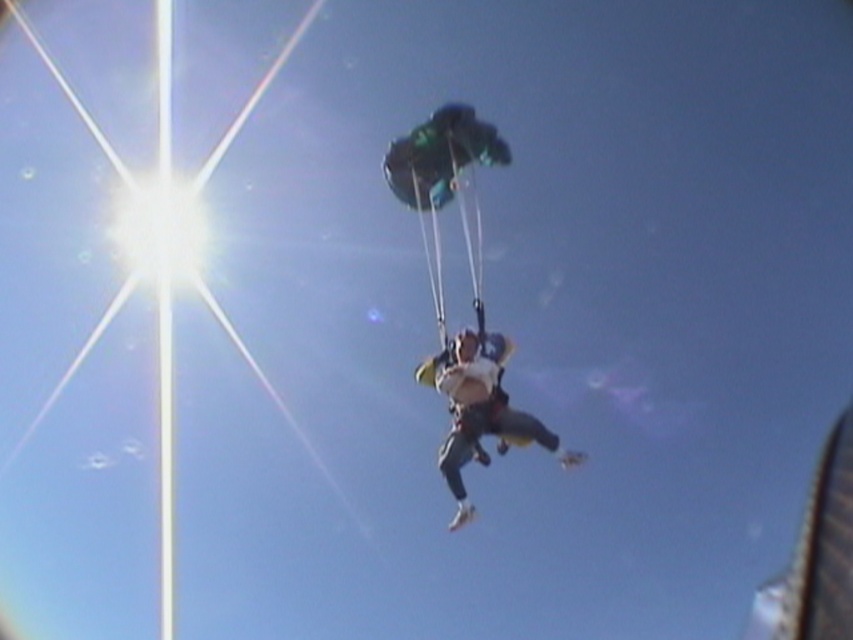
Can you confirm if green fabric parachute at center is positioned above white fabric parachute at center?

Yes, green fabric parachute at center is above white fabric parachute at center.

Which of these two, green fabric parachute at center or white fabric parachute at center, stands shorter?

Standing shorter between the two is white fabric parachute at center.

Who is more forward, (428, 230) or (457, 525)?

Point (457, 525) is more forward.

In order to click on green fabric parachute at center in this screenshot , I will do `click(445, 188)`.